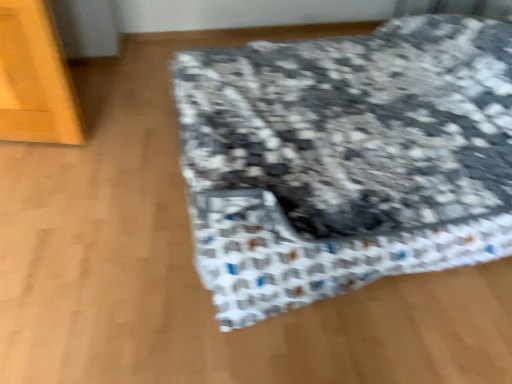
Where is `patterned fabric suitcase at center`? This screenshot has height=384, width=512. patterned fabric suitcase at center is located at coordinates (345, 159).

The width and height of the screenshot is (512, 384). What do you see at coordinates (345, 159) in the screenshot?
I see `patterned fabric suitcase at center` at bounding box center [345, 159].

This screenshot has width=512, height=384. I want to click on patterned fabric suitcase at center, so click(345, 159).